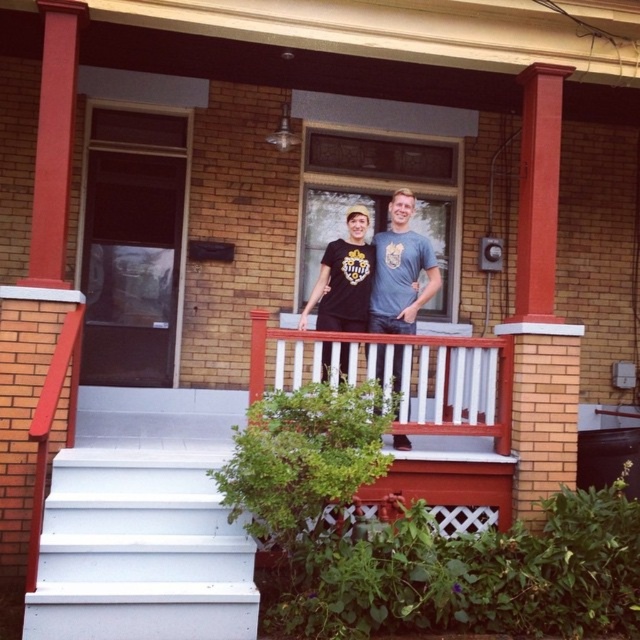
Question: Which point is closer to the camera?

Choices:
 (A) white painted wood stairs at lower left
 (B) matte gray t-shirt at center
 (C) white painted wood at center
 (D) black matte t-shirt at center

Answer: (A)

Question: Does white painted wood at center come behind black matte t-shirt at center?

Choices:
 (A) no
 (B) yes

Answer: (A)

Question: Is white painted wood stairs at lower left above matte gray t-shirt at center?

Choices:
 (A) yes
 (B) no

Answer: (B)

Question: Among these points, which one is nearest to the camera?

Choices:
 (A) (378, 342)
 (B) (179, 392)
 (C) (552, 90)

Answer: (A)

Question: Is white painted wood at center smaller than matte gray t-shirt at center?

Choices:
 (A) yes
 (B) no

Answer: (B)

Question: Which of the following is the closest to the observer?

Choices:
 (A) black matte t-shirt at center
 (B) white painted wood at center
 (C) matte gray t-shirt at center
 (D) brick column at center

Answer: (B)